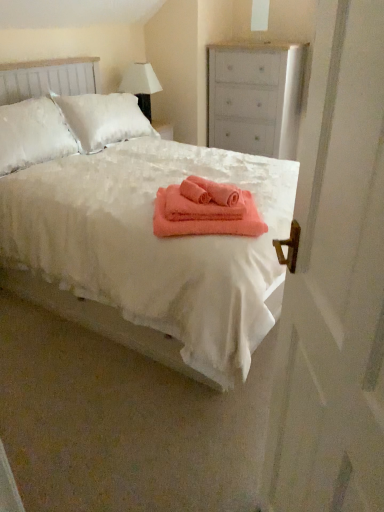
Question: Does coral soft towel at center, the 1th bath towel in the bottom-to-top sequence, turn towards white fluffy bed at center?

Choices:
 (A) no
 (B) yes

Answer: (B)

Question: Is coral soft towel at center, the second bath towel when ordered from top to bottom, positioned in front of white fluffy bed at center?

Choices:
 (A) no
 (B) yes

Answer: (A)

Question: Is coral soft towel at center, the second bath towel when ordered from top to bottom, outside white fluffy bed at center?

Choices:
 (A) yes
 (B) no

Answer: (B)

Question: Is coral soft towel at center, the 1th bath towel in the bottom-to-top sequence, at the left side of white fluffy bed at center?

Choices:
 (A) yes
 (B) no

Answer: (B)

Question: Does coral soft towel at center, the 1th bath towel in the bottom-to-top sequence, have a larger size compared to white fluffy bed at center?

Choices:
 (A) yes
 (B) no

Answer: (B)

Question: Can you confirm if coral soft towel at center, the second bath towel when ordered from top to bottom, is smaller than white fluffy bed at center?

Choices:
 (A) yes
 (B) no

Answer: (A)

Question: Considering the relative sizes of white matte screen door at right and coral soft towel at center, the 1th bath towel in the bottom-to-top sequence, in the image provided, is white matte screen door at right smaller than coral soft towel at center, the 1th bath towel in the bottom-to-top sequence,?

Choices:
 (A) yes
 (B) no

Answer: (B)

Question: Considering the relative sizes of white matte screen door at right and coral soft towel at center, the 1th bath towel in the bottom-to-top sequence, in the image provided, is white matte screen door at right wider than coral soft towel at center, the 1th bath towel in the bottom-to-top sequence,?

Choices:
 (A) yes
 (B) no

Answer: (B)

Question: Is white matte screen door at right next to coral soft towel at center, the second bath towel when ordered from top to bottom?

Choices:
 (A) yes
 (B) no

Answer: (B)

Question: From a real-world perspective, is white matte screen door at right located higher than coral soft towel at center, the second bath towel when ordered from top to bottom?

Choices:
 (A) yes
 (B) no

Answer: (A)

Question: Does white matte screen door at right have a larger size compared to coral soft towel at center, the second bath towel when ordered from top to bottom?

Choices:
 (A) yes
 (B) no

Answer: (A)

Question: Considering the relative positions of white matte screen door at right and coral soft towel at center, the 1th bath towel in the bottom-to-top sequence, in the image provided, is white matte screen door at right to the right of coral soft towel at center, the 1th bath towel in the bottom-to-top sequence, from the viewer's perspective?

Choices:
 (A) no
 (B) yes

Answer: (B)

Question: Can you confirm if white fabric lampshade at upper center is shorter than white fluffy bed at center?

Choices:
 (A) no
 (B) yes

Answer: (B)